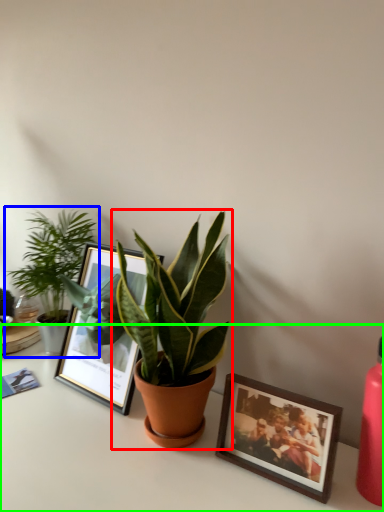
Question: Considering the real-world distances, which object is closest to houseplant (highlighted by a red box)? houseplant (highlighted by a blue box) or table (highlighted by a green box).

Choices:
 (A) houseplant
 (B) table

Answer: (B)